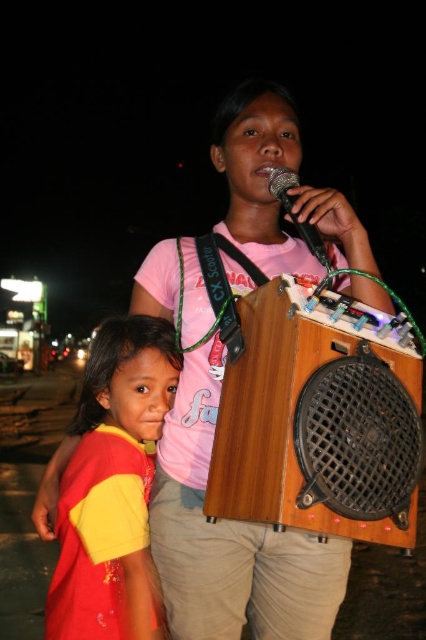
Question: Which object appears closest to the camera in this image?

Choices:
 (A) wooden speaker at center
 (B) yellow fabric shirt at lower left

Answer: (A)

Question: Is wooden speaker at center closer to the viewer compared to yellow fabric shirt at lower left?

Choices:
 (A) no
 (B) yes

Answer: (B)

Question: Among these objects, which one is farthest from the camera?

Choices:
 (A) black matte microphone at upper center
 (B) wooden speaker at center
 (C) yellow fabric shirt at lower left

Answer: (C)

Question: Is wooden speaker at center closer to camera compared to black matte microphone at upper center?

Choices:
 (A) no
 (B) yes

Answer: (B)

Question: Does wooden speaker at center have a greater width compared to black matte microphone at upper center?

Choices:
 (A) yes
 (B) no

Answer: (A)

Question: Considering the real-world distances, which object is closest to the black matte microphone at upper center?

Choices:
 (A) wooden speaker at center
 (B) yellow fabric shirt at lower left

Answer: (A)